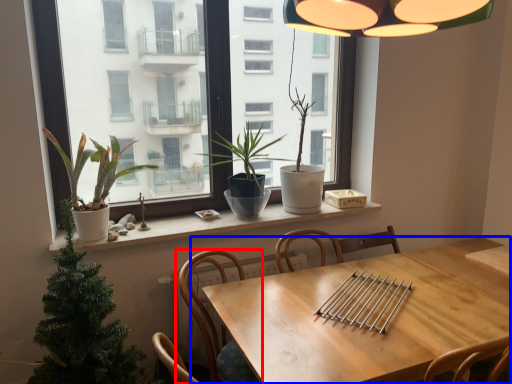
Question: Among these objects, which one is nearest to the camera, chair (highlighted by a red box) or table (highlighted by a blue box)?

Choices:
 (A) chair
 (B) table

Answer: (B)